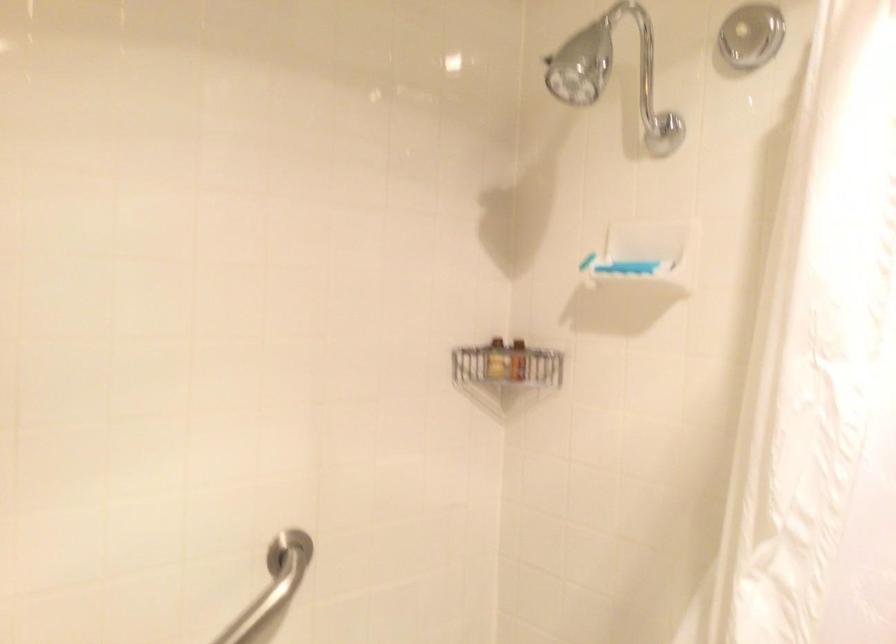
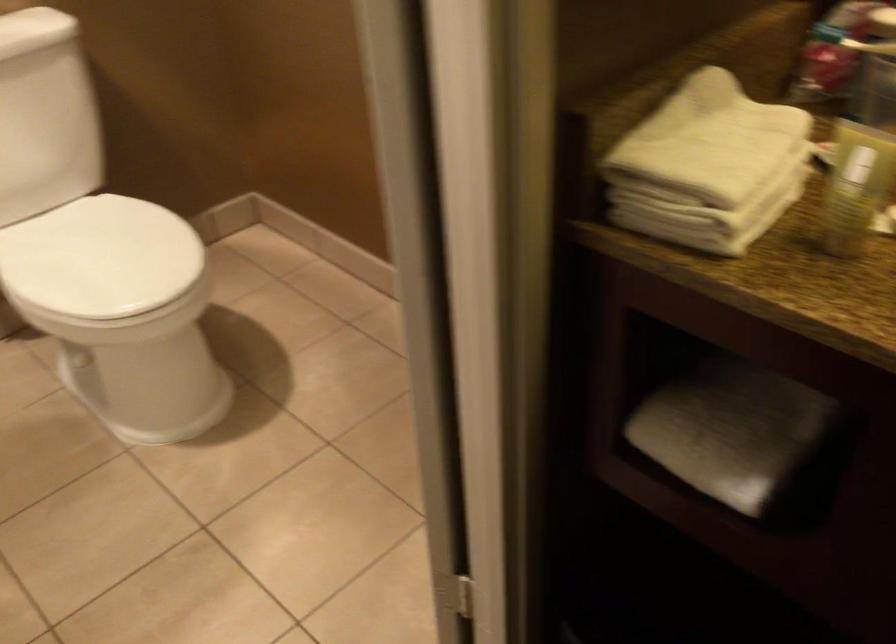
The images are taken continuously from a first-person perspective. In which direction is your viewpoint rotating?

The camera rotated toward right-down.